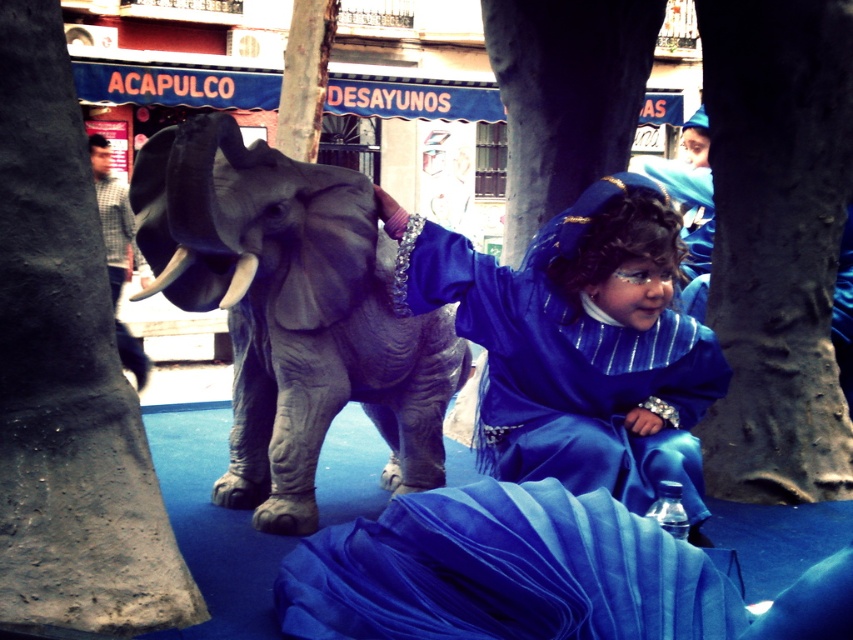
Can you confirm if gray matte elephant at center is shorter than smooth gray tree trunk at center?

Incorrect, gray matte elephant at center's height does not fall short of smooth gray tree trunk at center's.

Is point (413, 465) closer to viewer compared to point (506, 256)?

Yes.

Does point (287, 268) come in front of point (543, 124)?

Yes, point (287, 268) is closer to viewer.

The image size is (853, 640). What are the coordinates of `gray matte elephant at center` in the screenshot? It's located at (289, 308).

Is dark gray bark tree trunk at lower right smaller than smooth gray tree trunk at center?

Correct, dark gray bark tree trunk at lower right occupies less space than smooth gray tree trunk at center.

Between dark gray bark tree trunk at lower right and smooth gray tree trunk at center, which one appears on the right side from the viewer's perspective?

A: dark gray bark tree trunk at lower right

Is point (751, 49) in front of point (515, 196)?

Yes, it is.

The height and width of the screenshot is (640, 853). Find the location of `dark gray bark tree trunk at lower right`. dark gray bark tree trunk at lower right is located at coordinates (776, 243).

Does smooth gray tree trunk at left have a lesser width compared to smooth bark tree trunk at center?

In fact, smooth gray tree trunk at left might be wider than smooth bark tree trunk at center.

Can you confirm if smooth gray tree trunk at left is shorter than smooth bark tree trunk at center?

In fact, smooth gray tree trunk at left may be taller than smooth bark tree trunk at center.

Between point (57, 368) and point (328, 52), which one is positioned in front?

Point (57, 368) is more forward.

The image size is (853, 640). Find the location of `smooth gray tree trunk at left`. smooth gray tree trunk at left is located at coordinates (67, 374).